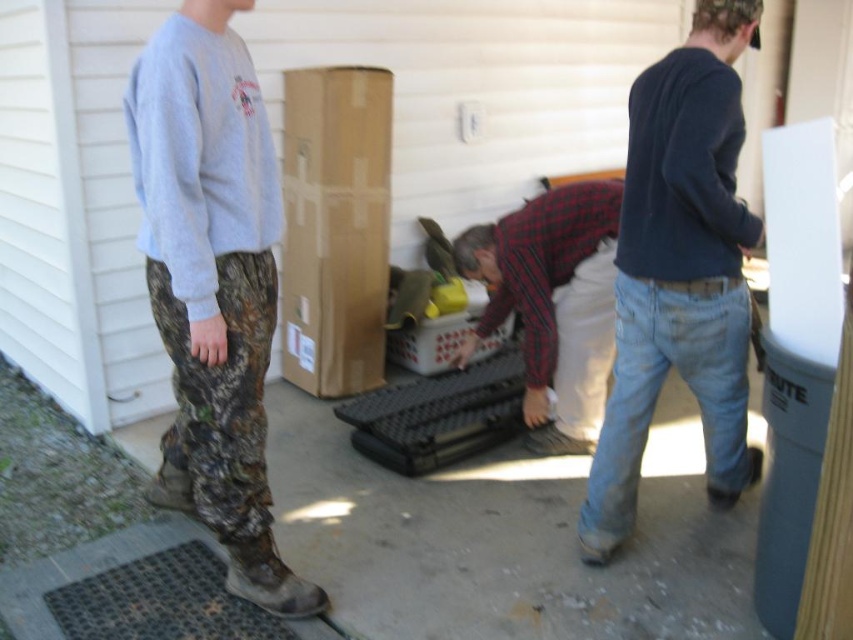
Measure the distance between camo pants at left and camera.

A distance of 1.68 meters exists between camo pants at left and camera.

This screenshot has height=640, width=853. I want to click on camo pants at left, so click(212, 284).

Who is positioned more to the left, brown cardboard box at center or plaid shirt at center?

brown cardboard box at center is more to the left.

Can you confirm if brown cardboard box at center is smaller than plaid shirt at center?

Yes.

This screenshot has width=853, height=640. What do you see at coordinates (335, 227) in the screenshot?
I see `brown cardboard box at center` at bounding box center [335, 227].

Locate an element on the screen. The width and height of the screenshot is (853, 640). brown cardboard box at center is located at coordinates click(x=335, y=227).

Does point (245, 376) come farther from viewer compared to point (624, 202)?

No, (245, 376) is in front of (624, 202).

Does camo pants at left have a lesser height compared to dark blue sweater at center?

Yes, camo pants at left is shorter than dark blue sweater at center.

Who is more distant from viewer, (241, 492) or (692, 355)?

Positioned behind is point (692, 355).

Locate an element on the screen. This screenshot has height=640, width=853. camo pants at left is located at coordinates (212, 284).